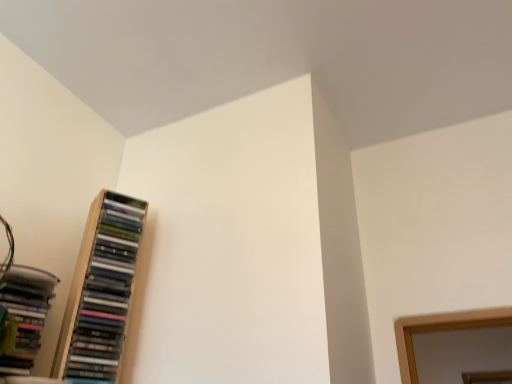
Question: Could you tell me if matte black books at left is facing wooden bookcase at left?

Choices:
 (A) yes
 (B) no

Answer: (B)

Question: From the image's perspective, is matte black books at left located beneath wooden bookcase at left?

Choices:
 (A) yes
 (B) no

Answer: (A)

Question: Is wooden bookcase at left located within matte black books at left?

Choices:
 (A) yes
 (B) no

Answer: (B)

Question: Considering the relative sizes of matte black books at left and wooden bookcase at left in the image provided, is matte black books at left shorter than wooden bookcase at left?

Choices:
 (A) yes
 (B) no

Answer: (A)

Question: Is matte black books at left wider than wooden bookcase at left?

Choices:
 (A) no
 (B) yes

Answer: (B)

Question: Is matte black books at left outside wooden bookcase at left?

Choices:
 (A) no
 (B) yes

Answer: (B)

Question: From the image's perspective, is wooden bookcase at left on top of matte black books at left?

Choices:
 (A) yes
 (B) no

Answer: (A)

Question: Does wooden bookcase at left have a larger size compared to matte black books at left?

Choices:
 (A) yes
 (B) no

Answer: (A)

Question: From a real-world perspective, does wooden bookcase at left stand above matte black books at left?

Choices:
 (A) yes
 (B) no

Answer: (A)

Question: Does wooden bookcase at left have a smaller size compared to matte black books at left?

Choices:
 (A) yes
 (B) no

Answer: (B)

Question: Can you confirm if wooden bookcase at left is positioned to the left of matte black books at left?

Choices:
 (A) no
 (B) yes

Answer: (A)

Question: Does wooden bookcase at left come behind matte black books at left?

Choices:
 (A) yes
 (B) no

Answer: (A)

Question: Is point (114, 316) closer or farther from the camera than point (7, 296)?

Choices:
 (A) closer
 (B) farther

Answer: (B)